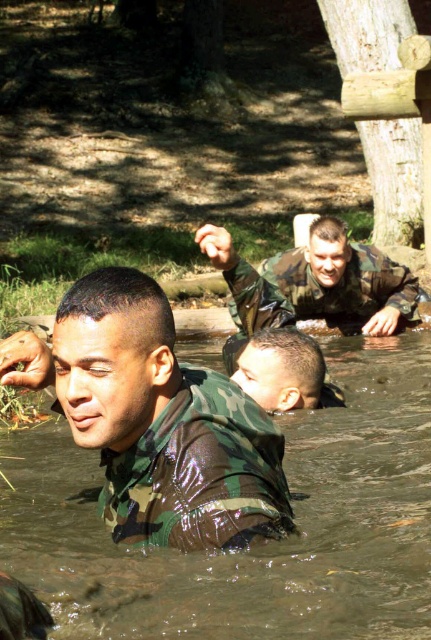
Question: Is camouflage fabric man at center behind camo uniform head at center?

Choices:
 (A) yes
 (B) no

Answer: (B)

Question: Which object is positioned farthest from the camouflage uniform at center?

Choices:
 (A) camouflage fabric man at center
 (B) camouflage uniform at upper center
 (C) camo uniform head at center

Answer: (B)

Question: Is camouflage uniform at upper center to the left of camo uniform head at center from the viewer's perspective?

Choices:
 (A) yes
 (B) no

Answer: (B)

Question: Which object appears farthest from the camera in this image?

Choices:
 (A) camouflage uniform at center
 (B) camouflage fabric man at center
 (C) camo uniform head at center

Answer: (C)

Question: Considering the relative positions of camouflage fabric man at center and camouflage uniform at center in the image provided, where is camouflage fabric man at center located with respect to camouflage uniform at center?

Choices:
 (A) above
 (B) below

Answer: (B)

Question: Among these points, which one is nearest to the camera?

Choices:
 (A) (112, 323)
 (B) (244, 310)

Answer: (A)